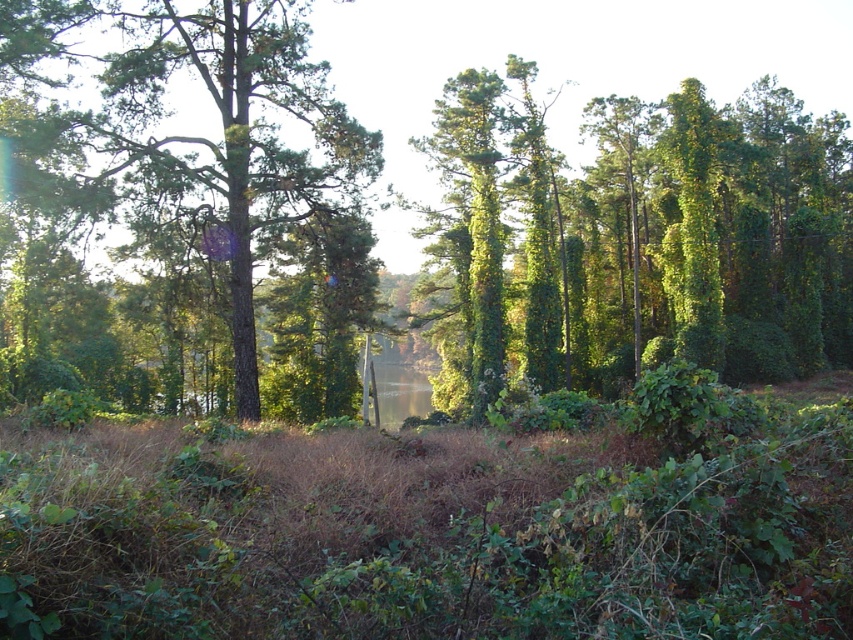
Is green leafy tree at upper center wider than green matte tree at center?

Yes.

Where is `green leafy tree at upper center`? green leafy tree at upper center is located at coordinates (654, 237).

Where is `green leafy tree at upper center`? green leafy tree at upper center is located at coordinates (654, 237).